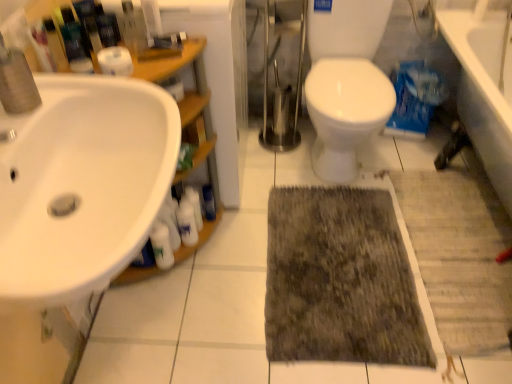
Identify the location of vacant space that is in between white glossy bottle at lower left, marked as the second cleaning product in a right-to-left arrangement, and dark gray shaggy rug at center. (236, 264).